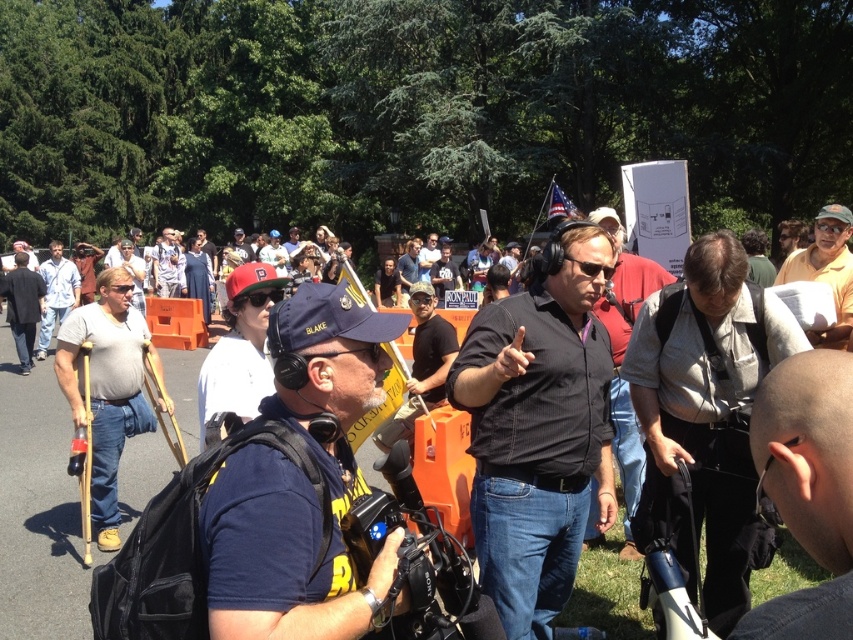
Question: Which point appears farthest from the camera in this image?

Choices:
 (A) (746, 548)
 (B) (445, 340)
 (C) (38, 305)
 (D) (805, 262)

Answer: (C)

Question: Is light blue shirt at center closer to camera compared to blue denim shirt at center?

Choices:
 (A) yes
 (B) no

Answer: (A)

Question: Considering the real-world distances, which object is closest to the black cotton t-shirt at center?

Choices:
 (A) black striped shirt at center
 (B) light blue shirt at center
 (C) light brown leather jacket at left

Answer: (A)

Question: Does matte gray shirt at center have a smaller size compared to blue denim shirt at center?

Choices:
 (A) yes
 (B) no

Answer: (B)

Question: Can you confirm if light brown wood crutches at left is smaller than matte gray shirt at center?

Choices:
 (A) no
 (B) yes

Answer: (B)

Question: Which object appears closest to the camera in this image?

Choices:
 (A) light blue shirt at center
 (B) dark blue dress at center

Answer: (A)